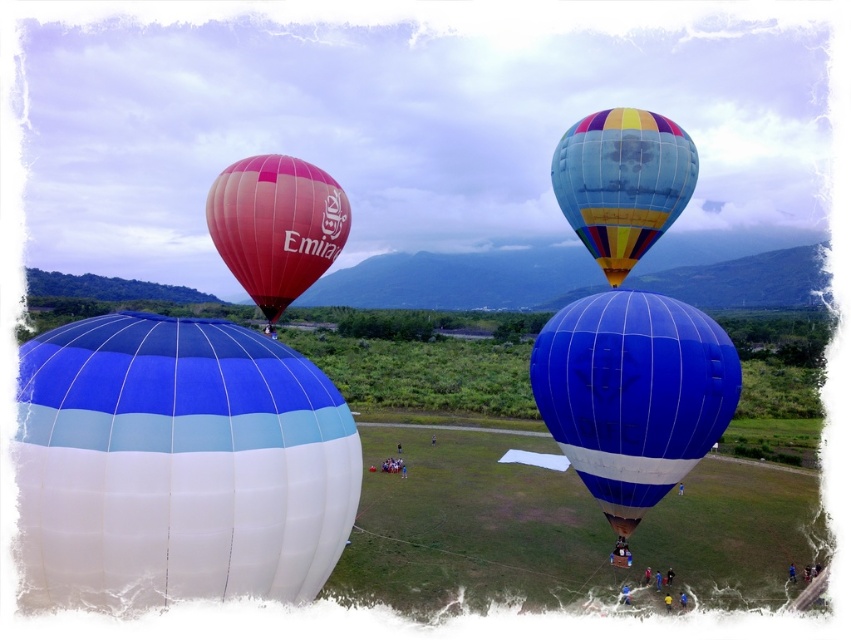
Is blue/white striped balloon at lower left further to camera compared to blue glossy hot air balloon at center?

No.

Between point (95, 385) and point (632, 392), which one is positioned behind?

Positioned behind is point (632, 392).

Identify the location of blue/white striped balloon at lower left. The image size is (851, 640). tap(176, 465).

Between point (215, 454) and point (278, 177), which one is positioned behind?

Positioned behind is point (278, 177).

Who is more forward, (124, 541) or (347, 209)?

Positioned in front is point (124, 541).

Locate an element on the screen. The width and height of the screenshot is (851, 640). blue/white striped balloon at lower left is located at coordinates (176, 465).

Does blue glossy hot air balloon at center have a larger size compared to matte pink balloon at center-left?

Yes.

Can you confirm if blue glossy hot air balloon at center is positioned below matte pink balloon at center-left?

Indeed, blue glossy hot air balloon at center is positioned under matte pink balloon at center-left.

What do you see at coordinates (632, 394) in the screenshot? The height and width of the screenshot is (640, 851). I see `blue glossy hot air balloon at center` at bounding box center [632, 394].

The height and width of the screenshot is (640, 851). Find the location of `blue glossy hot air balloon at center`. blue glossy hot air balloon at center is located at coordinates (632, 394).